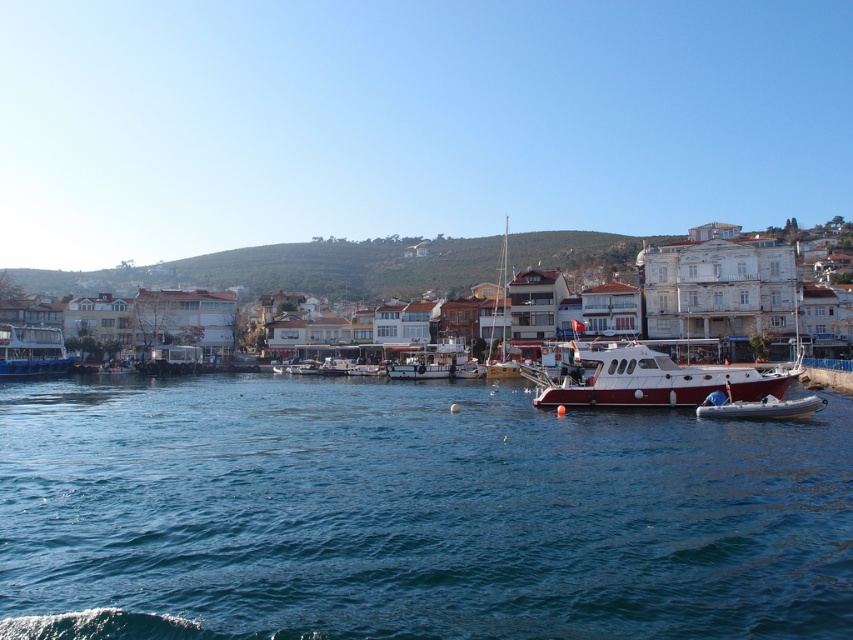
Question: Is blue metallic boat at left above white glossy boat at center?

Choices:
 (A) yes
 (B) no

Answer: (A)

Question: Does white matte building at center have a smaller size compared to blue metallic boat at left?

Choices:
 (A) yes
 (B) no

Answer: (B)

Question: Which point is closer to the camera?

Choices:
 (A) (735, 416)
 (B) (35, 369)
 (C) (281, 257)
 (D) (618, 400)

Answer: (A)

Question: Which is nearer to the red polished wood boat at center?

Choices:
 (A) white matte building at center
 (B) blue metallic boat at left
 (C) blue water at center

Answer: (C)

Question: Which object appears farthest from the camera in this image?

Choices:
 (A) white matte building at center
 (B) white glossy boat at center
 (C) blue rubber dinghy at lower right

Answer: (B)

Question: Does blue water at center have a larger size compared to white glossy boat at center?

Choices:
 (A) yes
 (B) no

Answer: (A)